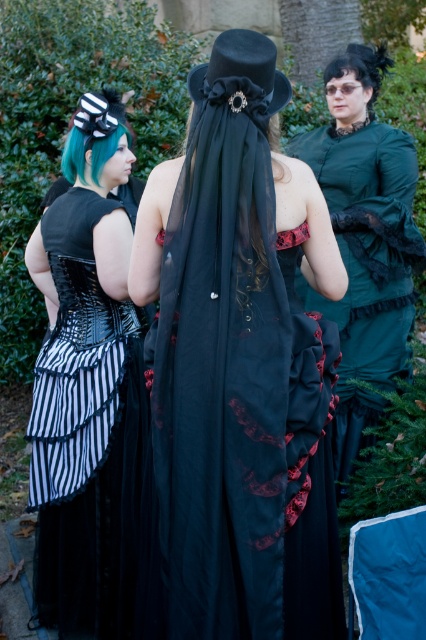
In the scene shown: You are a photographer at a cosplay event. You need to place a prop at the point marked by coordinates (x=88, y=390). Which costume should the prop be placed near?

The point (x=88, y=390) corresponds to the black striped fabric dress at left, so the prop should be placed near the black striped fabric dress at left.

You are standing at the position of point (108, 524) and want to move towards point (175, 592). Based on the scene description, will you be moving forward or backward relative to your current position?

Since point (175, 592) is in front of point (108, 524), moving towards it would mean moving forward from your current position.

Based on the photo, you are a photographer at a costume event. You need to adjust the lighting between the matte black veil at center and the velvet green dress at center so that they are equally illuminated. Given that they are 1.06 meters apart, what is the minimum distance you should set your lighting equipment to cover both objects effectively?

The minimum distance the lighting equipment should cover is 1.06 meters to ensure both the matte black veil at center and the velvet green dress at center are equally illuminated.